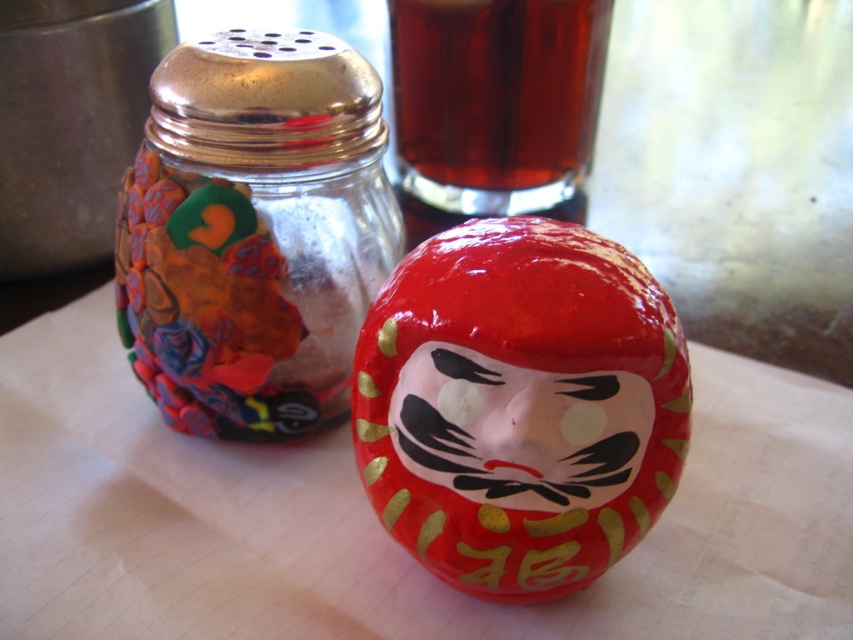
You are arranging items on a table and want to place a small vase of flowers between the brown liquid at upper center and the glossy ceramic face at center. Based on their positions, where should you place the vase?

The brown liquid at upper center is above the glossy ceramic face at center, so you should place the vase between them in the middle area between the upper center and the center positions.

You are a delivery person who needs to place a package on the table. The package is 30 inches long. You see the brown liquid at upper center and the glossy ceramic face at center. Can you fit the package between them without spilling the liquid?

The distance between the brown liquid at upper center and the glossy ceramic face at center is 29.21 inches. Since the package is 30 inches long, it is slightly longer than the available space. Therefore, placing the package between them may cause it to spill the liquid.

You are a painter standing in front of the image. You want to paint the brown liquid at upper center and the glossy ceramic face at center. Which object should you paint first to ensure proper layering?

The brown liquid at upper center is closer to the viewer than the glossy ceramic face at center, so you should paint the brown liquid at upper center first to ensure proper layering.